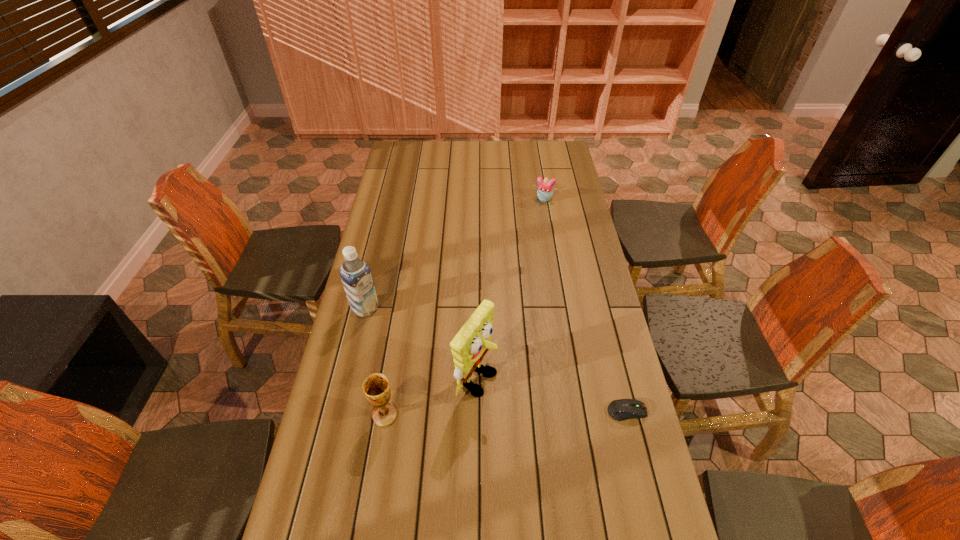
Where is `free location that satisfies the following two spatial constraints: 1. on the front side of the leftmost object; 2. on the right side of the third tallest object`? This screenshot has width=960, height=540. free location that satisfies the following two spatial constraints: 1. on the front side of the leftmost object; 2. on the right side of the third tallest object is located at coordinates (340, 415).